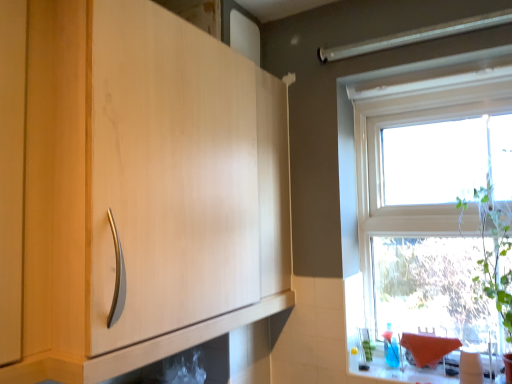
Question: Considering the relative positions of white glossy counter top at lower right and transparent glass window at upper right in the image provided, is white glossy counter top at lower right to the left of transparent glass window at upper right from the viewer's perspective?

Choices:
 (A) yes
 (B) no

Answer: (A)

Question: Is white glossy counter top at lower right shorter than transparent glass window at upper right?

Choices:
 (A) yes
 (B) no

Answer: (A)

Question: From a real-world perspective, is white glossy counter top at lower right beneath transparent glass window at upper right?

Choices:
 (A) yes
 (B) no

Answer: (A)

Question: Is white glossy counter top at lower right oriented away from transparent glass window at upper right?

Choices:
 (A) no
 (B) yes

Answer: (A)

Question: Is white glossy counter top at lower right far away from transparent glass window at upper right?

Choices:
 (A) yes
 (B) no

Answer: (B)

Question: Does white glossy counter top at lower right turn towards transparent glass window at upper right?

Choices:
 (A) no
 (B) yes

Answer: (A)

Question: Considering the relative sizes of white glossy counter top at lower right and matte wood cabinet at center in the image provided, is white glossy counter top at lower right bigger than matte wood cabinet at center?

Choices:
 (A) yes
 (B) no

Answer: (B)

Question: Is white glossy counter top at lower right thinner than matte wood cabinet at center?

Choices:
 (A) no
 (B) yes

Answer: (B)

Question: Is white glossy counter top at lower right touching matte wood cabinet at center?

Choices:
 (A) yes
 (B) no

Answer: (B)

Question: Could matte wood cabinet at center be considered to be inside white glossy counter top at lower right?

Choices:
 (A) yes
 (B) no

Answer: (B)

Question: Could you tell me if white glossy counter top at lower right is turned towards matte wood cabinet at center?

Choices:
 (A) no
 (B) yes

Answer: (A)

Question: Is white glossy counter top at lower right looking in the opposite direction of matte wood cabinet at center?

Choices:
 (A) yes
 (B) no

Answer: (B)

Question: Is matte wood cabinet at center further to the viewer compared to white glossy counter top at lower right?

Choices:
 (A) no
 (B) yes

Answer: (A)